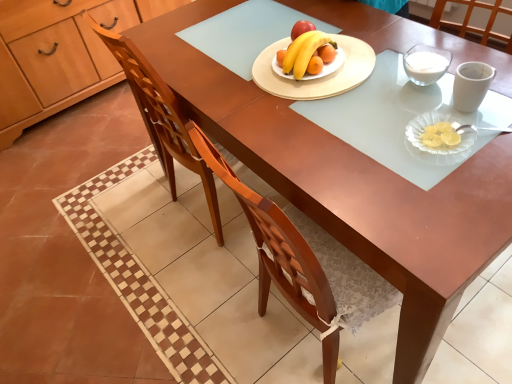
Where is `free space to the left of yellow matte banana at center`? The height and width of the screenshot is (384, 512). free space to the left of yellow matte banana at center is located at coordinates (244, 76).